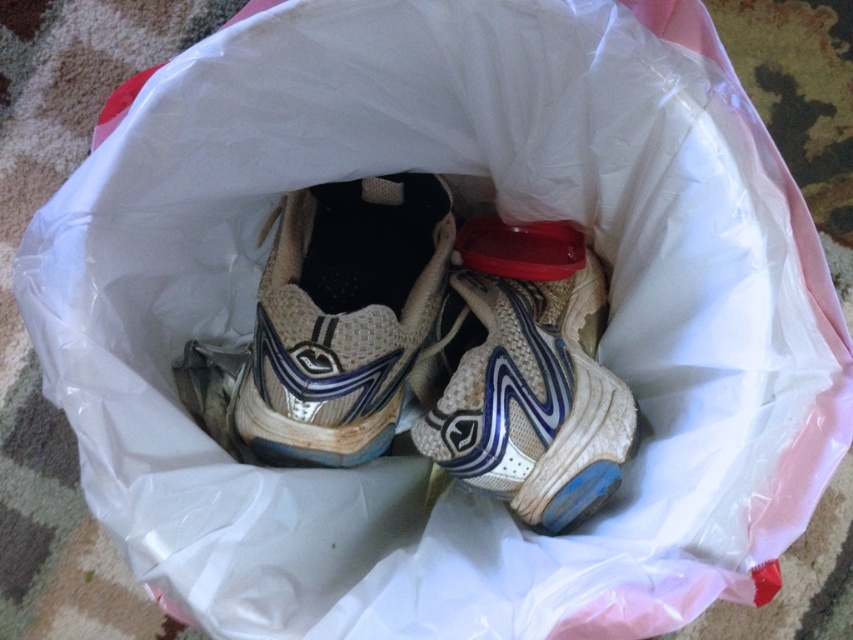
You are standing in front of the plastic bag with the athletic shoes. You notice two points marked on the bag. Which point is closer to you, point (339, 368) or point (596, 451)?

Point (339, 368) is closer to you because it is further to the camera than point (596, 451).

You are organizing a charity drive and need to pack two pairs of shoes into a box. You have a worn beige fabric shoe at center and a white mesh shoe at center. Since the box has limited space, which shoe should you place first to optimize packing efficiency?

The worn beige fabric shoe at center should be placed first because it has a smaller size compared to the white mesh shoe at center, allowing more space for the larger shoe afterward.

You are organizing a shoe collection and need to place the worn beige fabric shoe at center and the white mesh shoe at center into a storage box. Which shoe should you place first if you want to maximize vertical space?

The worn beige fabric shoe at center is not as tall as the white mesh shoe at center, so you should place the white mesh shoe at center first to utilize vertical space effectively.